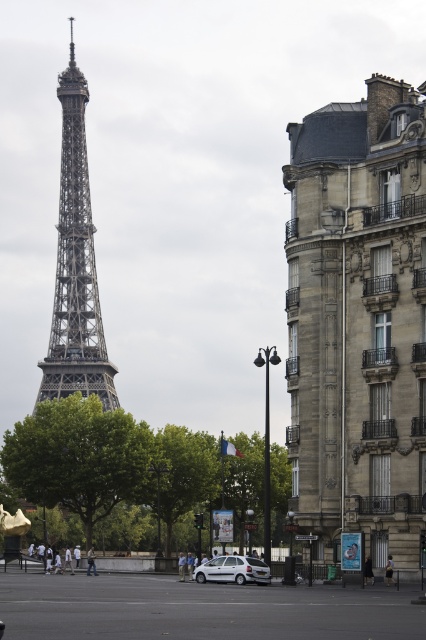
Between point (224, 563) and point (388, 564), which one is positioned in front?

Point (388, 564) is more forward.

Does white matte car at lower center have a lesser height compared to dark gray fabric pants at center?

No.

Describe the element at coordinates (233, 570) in the screenshot. I see `white matte car at lower center` at that location.

The height and width of the screenshot is (640, 426). I want to click on white matte car at lower center, so click(x=233, y=570).

Is metallic lattice tower at center positioned at the back of black fabric person at lower center?

Yes, metallic lattice tower at center is behind black fabric person at lower center.

This screenshot has width=426, height=640. What do you see at coordinates (75, 266) in the screenshot?
I see `metallic lattice tower at center` at bounding box center [75, 266].

Is point (66, 387) behind point (368, 573)?

That is True.

Locate an element on the screen. metallic lattice tower at center is located at coordinates (75, 266).

This screenshot has height=640, width=426. What are the coordinates of `dark gray fabric pants at center` in the screenshot? It's located at (388, 570).

Does point (388, 577) come closer to viewer compared to point (92, 557)?

Yes.

Identify the location of dark gray fabric pants at center. The image size is (426, 640). (388, 570).